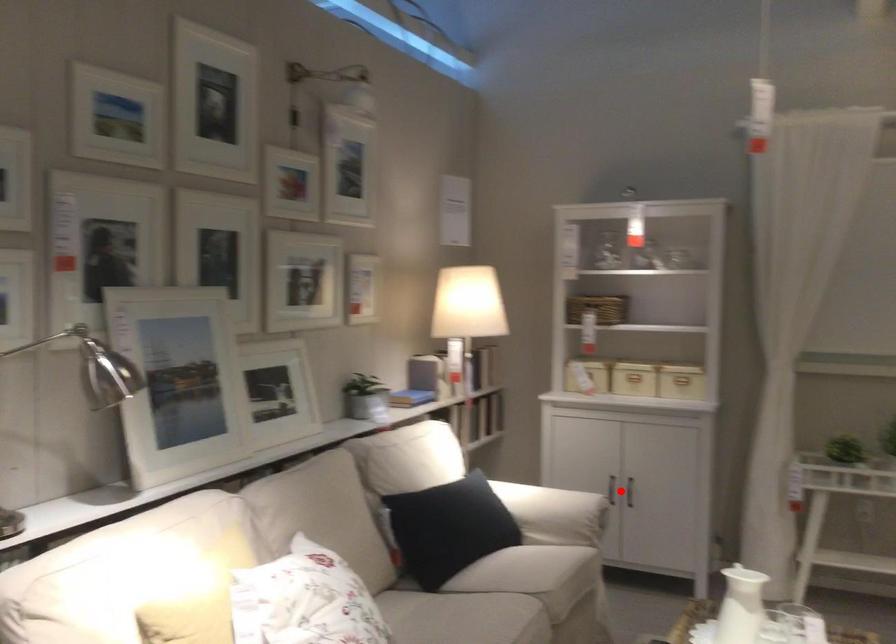
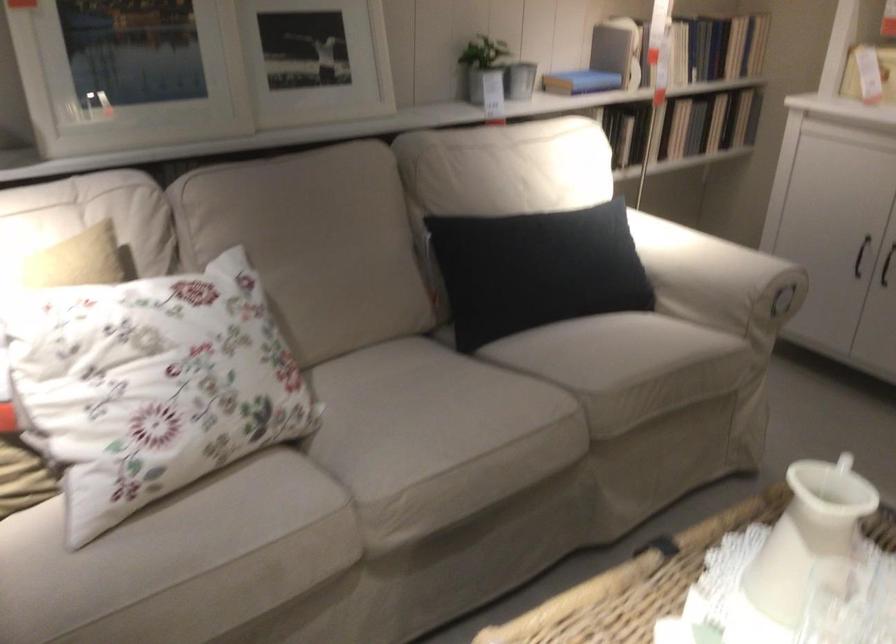
The point at the highlighted location is marked in the first image. Where is the corresponding point in the second image?

(860, 256)